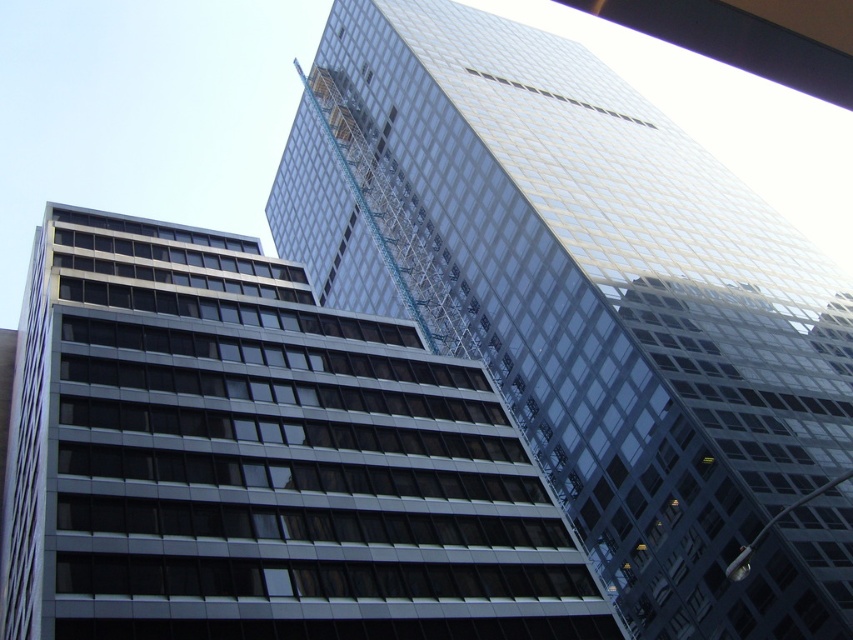
Is transparent glass tower at upper center shorter than clear glass building at center?

No.

Is transparent glass tower at upper center thinner than clear glass building at center?

Incorrect, transparent glass tower at upper center's width is not less than clear glass building at center's.

The width and height of the screenshot is (853, 640). Describe the element at coordinates (622, 314) in the screenshot. I see `transparent glass tower at upper center` at that location.

Find the location of `transparent glass tower at upper center`. transparent glass tower at upper center is located at coordinates (622, 314).